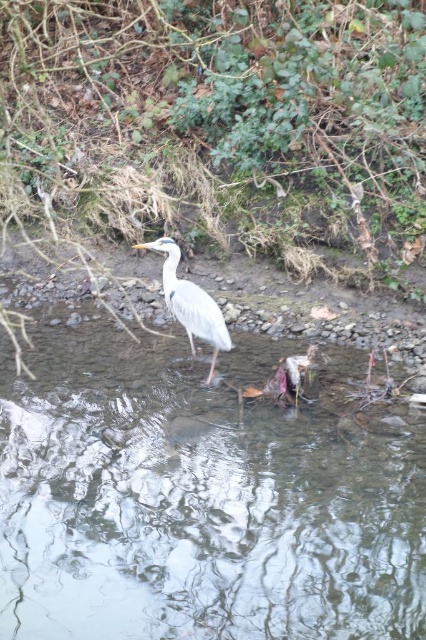
Question: Among these points, which one is nearest to the camera?

Choices:
 (A) (172, 243)
 (B) (302, 451)

Answer: (B)

Question: Can you confirm if clear water at center is thinner than gray feathered heron at center?

Choices:
 (A) yes
 (B) no

Answer: (B)

Question: Can you confirm if clear water at center is positioned to the left of gray feathered heron at center?

Choices:
 (A) no
 (B) yes

Answer: (B)

Question: Considering the relative positions of clear water at center and gray feathered heron at center in the image provided, where is clear water at center located with respect to gray feathered heron at center?

Choices:
 (A) below
 (B) above

Answer: (A)